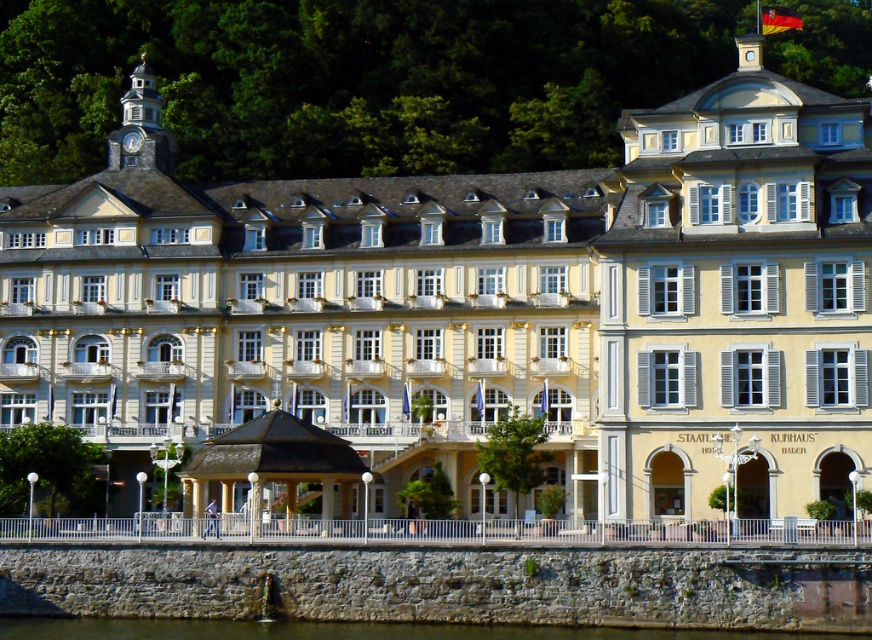
The width and height of the screenshot is (872, 640). What do you see at coordinates (351, 630) in the screenshot? I see `clear water at lower center` at bounding box center [351, 630].

Does clear water at lower center have a smaller size compared to stone clock tower at upper left?

Yes.

In order to click on clear water at lower center in this screenshot , I will do `click(351, 630)`.

This screenshot has height=640, width=872. What are the coordinates of `clear water at lower center` in the screenshot? It's located at (351, 630).